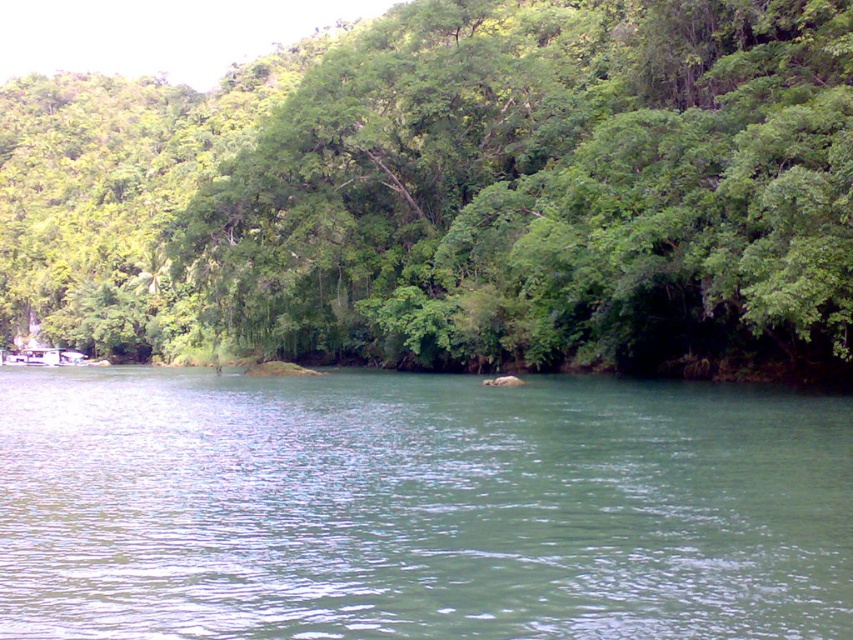
You are a bird flying over the scene and want to land on the green leafy trees at upper left. From your current position above the green smooth water at center, which direction should you fly to reach the trees?

The green leafy trees at upper left are wider than the green smooth water at center, so you should fly towards the upper left direction to reach them.

You are an observer looking at the scene. Which object is positioned to the left of the other between the green leafy trees at upper left and the green smooth water at center?

The green leafy trees at upper left are positioned to the left of the green smooth water at center.

You are a bird flying over the scene and want to land on the highest point between the green leafy trees at upper left and the green smooth water at center. Which one should you choose?

The green leafy trees at upper left is much taller than the green smooth water at center, so you should choose the green leafy trees at upper left to land on the highest point.